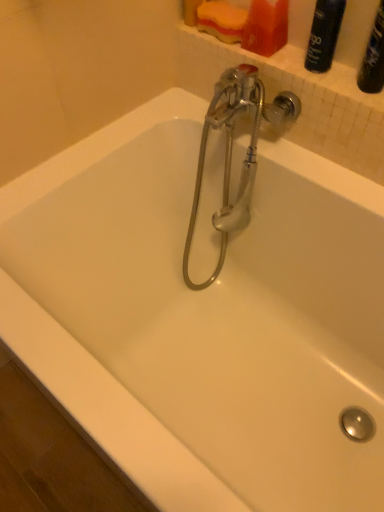
Identify the location of matte black spray can at upper right. (324, 35).

Find the location of a particular element. This screenshot has height=512, width=384. matte plastic soap at upper center is located at coordinates (266, 27).

What do you see at coordinates (231, 151) in the screenshot?
I see `chrome metallic faucet at center` at bounding box center [231, 151].

Find the location of `matte black spray can at upper right`. matte black spray can at upper right is located at coordinates (324, 35).

Are matte plastic soap at upper center and chrome metallic faucet at center beside each other?

matte plastic soap at upper center and chrome metallic faucet at center are clearly separated.

Is matte plastic soap at upper center looking in the opposite direction of chrome metallic faucet at center?

No, chrome metallic faucet at center is not at the back of matte plastic soap at upper center.

From a real-world perspective, who is located higher, matte plastic soap at upper center or chrome metallic faucet at center?

matte plastic soap at upper center.

Can you confirm if matte plastic soap at upper center is thinner than chrome metallic faucet at center?

Indeed, matte plastic soap at upper center has a lesser width compared to chrome metallic faucet at center.

Considering the sizes of objects chrome metallic faucet at center and matte plastic soap at upper center in the image provided, who is shorter, chrome metallic faucet at center or matte plastic soap at upper center?

With less height is matte plastic soap at upper center.

Considering their positions, is chrome metallic faucet at center located in front of or behind matte plastic soap at upper center?

In the image, chrome metallic faucet at center appears in front of matte plastic soap at upper center.

Is chrome metallic faucet at center spatially inside matte plastic soap at upper center, or outside of it?

chrome metallic faucet at center is located beyond the bounds of matte plastic soap at upper center.

Can you see chrome metallic faucet at center touching matte plastic soap at upper center?

No, chrome metallic faucet at center is not beside matte plastic soap at upper center.

From a real-world perspective, between chrome metallic faucet at center and matte black spray can at upper right, who is vertically lower?

chrome metallic faucet at center is physically lower.

Find the location of `tap that appears behind the matte black spray can at upper right`. tap that appears behind the matte black spray can at upper right is located at coordinates (231, 151).

Does chrome metallic faucet at center turn towards matte black spray can at upper right?

No, chrome metallic faucet at center does not turn towards matte black spray can at upper right.

Consider the image. Is chrome metallic faucet at center far from matte black spray can at upper right?

No.

Could you tell me if matte black spray can at upper right is turned towards matte plastic soap at upper center?

No, matte black spray can at upper right is not oriented towards matte plastic soap at upper center.

Considering the relative positions of matte black spray can at upper right and matte plastic soap at upper center in the image provided, is matte black spray can at upper right to the left of matte plastic soap at upper center from the viewer's perspective?

In fact, matte black spray can at upper right is to the right of matte plastic soap at upper center.

From the image's perspective, which one is positioned lower, matte black spray can at upper right or matte plastic soap at upper center?

From the image's view, matte black spray can at upper right is below.

Considering the positions of point (334, 45) and point (223, 246), is point (334, 45) closer or farther from the camera than point (223, 246)?

Point (334, 45) appears to be closer to the viewer than point (223, 246).

Identify the location of tap below the matte black spray can at upper right (from a real-world perspective). (231, 151).

Are matte black spray can at upper right and chrome metallic faucet at center making contact?

matte black spray can at upper right is not next to chrome metallic faucet at center, and they're not touching.

Which object is positioned more to the left, matte plastic soap at upper center or matte black spray can at upper right?

matte plastic soap at upper center is more to the left.

Consider the image. From a real-world perspective, which is physically below, matte plastic soap at upper center or matte black spray can at upper right?

matte plastic soap at upper center is physically lower.

From the image's perspective, between matte plastic soap at upper center and matte black spray can at upper right, who is located below?

matte black spray can at upper right, from the image's perspective.

Where is `toiletry above the chrome metallic faucet at center (from the image's perspective)`? This screenshot has width=384, height=512. toiletry above the chrome metallic faucet at center (from the image's perspective) is located at coordinates (266, 27).

Where is `tap below the matte plastic soap at upper center (from the image's perspective)`? The height and width of the screenshot is (512, 384). tap below the matte plastic soap at upper center (from the image's perspective) is located at coordinates (231, 151).

Based on their spatial positions, is chrome metallic faucet at center or matte black spray can at upper right further from matte plastic soap at upper center?

chrome metallic faucet at center lies further to matte plastic soap at upper center than the other object.

From the image, which object appears to be farther from matte plastic soap at upper center, matte black spray can at upper right or chrome metallic faucet at center?

Based on the image, chrome metallic faucet at center appears to be further to matte plastic soap at upper center.

Looking at the image, which one is located closer to chrome metallic faucet at center, matte plastic soap at upper center or matte black spray can at upper right?

Among the two, matte plastic soap at upper center is located nearer to chrome metallic faucet at center.

Based on their spatial positions, is matte black spray can at upper right or matte plastic soap at upper center further from chrome metallic faucet at center?

Among the two, matte black spray can at upper right is located further to chrome metallic faucet at center.

Estimate the real-world distances between objects in this image. Which object is closer to matte black spray can at upper right, chrome metallic faucet at center or matte plastic soap at upper center?

matte plastic soap at upper center is closer to matte black spray can at upper right.

When comparing their distances from matte black spray can at upper right, does matte plastic soap at upper center or chrome metallic faucet at center seem further?

chrome metallic faucet at center.

Locate an element on the screen. cleaning product between matte plastic soap at upper center and chrome metallic faucet at center in the vertical direction is located at coordinates 324,35.